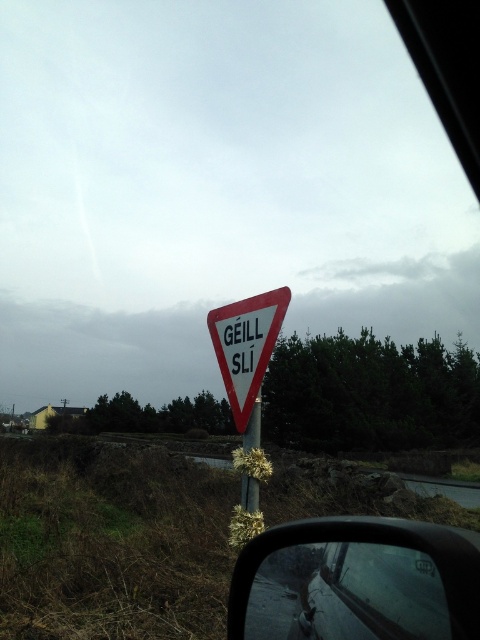
You are driving and see the white plastic triangle at center and the metallic pole at center in your rearview mirror. Which object will disappear first from your view as you continue moving forward?

Result: The white plastic triangle at center will disappear first because it is positioned to the left of the metallic pole at center, meaning it is closer to the edge of your view as you move forward.

You are driving a car and notice the black plastic side mirror at lower right and the metallic pole at center in your rearview mirror. Which object appears bigger in your reflection?

The black plastic side mirror at lower right appears bigger than the metallic pole at center because it has a larger size compared to the metallic pole at center.